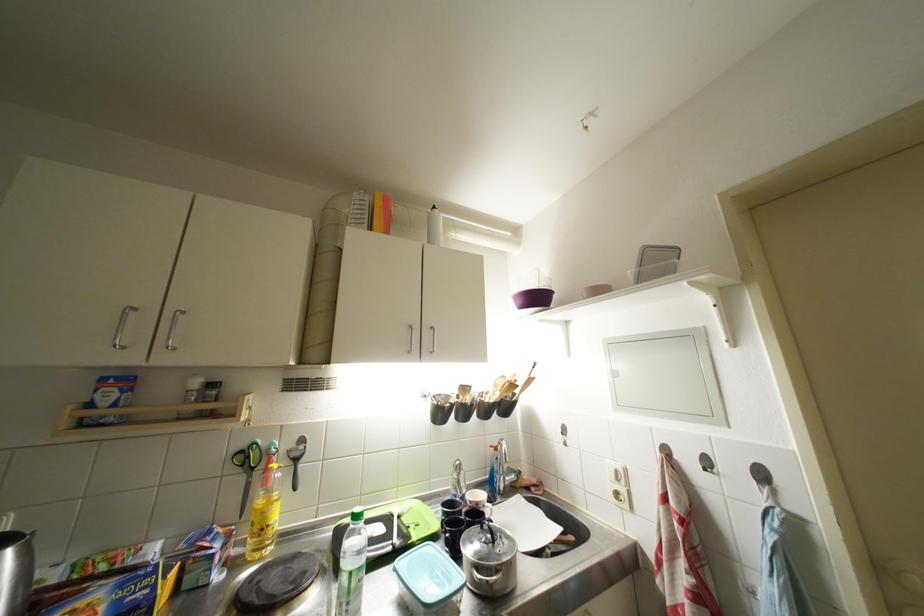
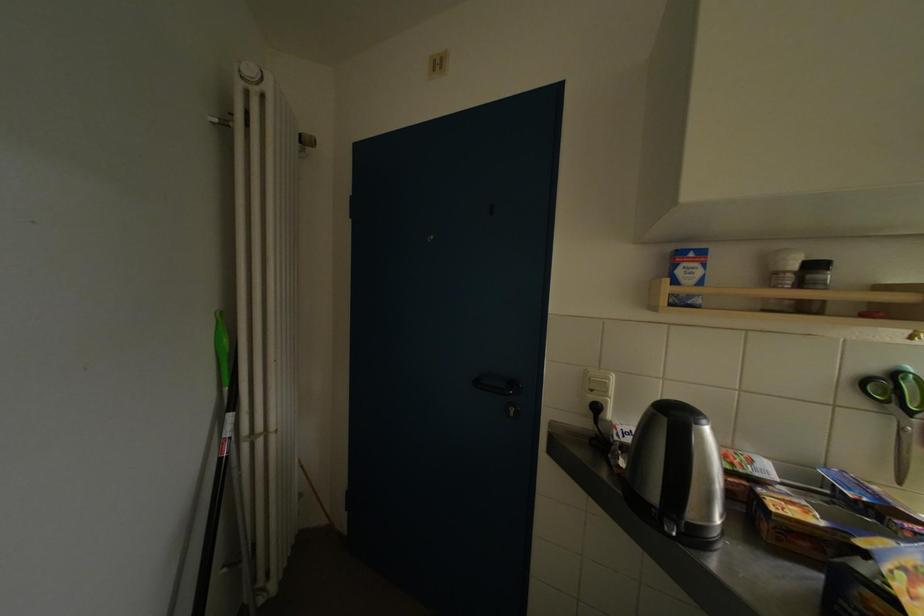
Where in the second image is the point corresponding to pixel 219 390 from the first image?

(821, 270)